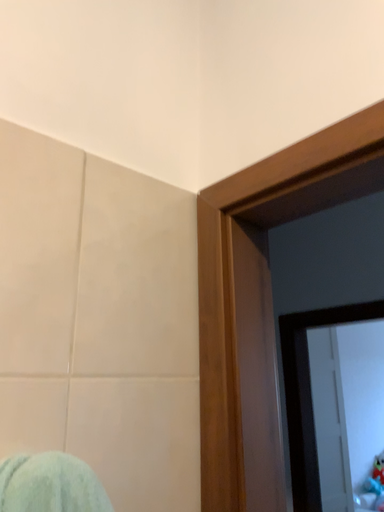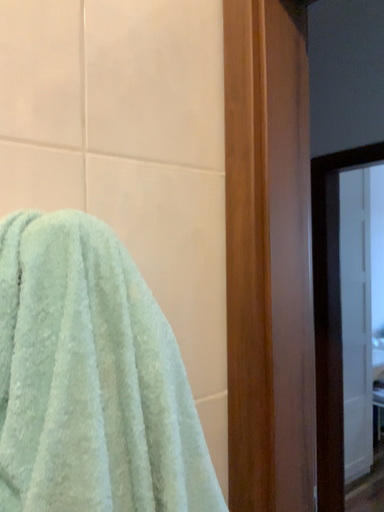
Question: Which way did the camera rotate in the video?

Choices:
 (A) rotated upward
 (B) rotated downward

Answer: (B)